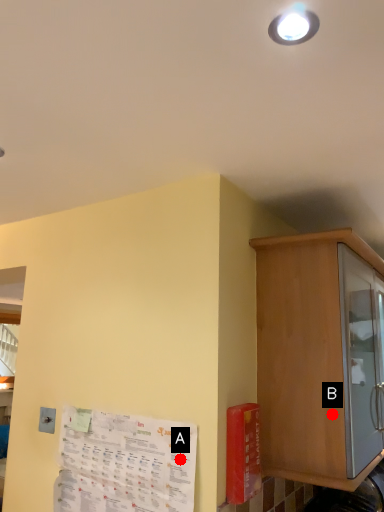
Question: Two points are circled on the image, labeled by A and B beside each circle. Among these points, which one is nearest to the camera?

Choices:
 (A) A is closer
 (B) B is closer

Answer: (A)